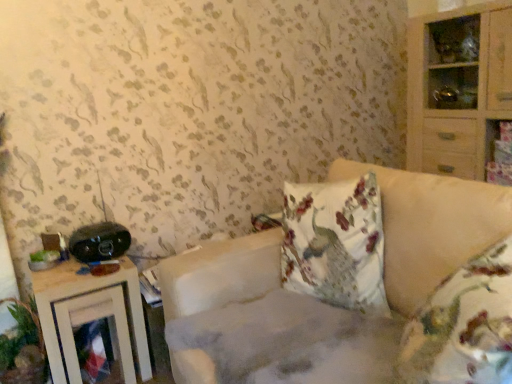
The image size is (512, 384). Find the location of `wooden nightstand at left`. wooden nightstand at left is located at coordinates (91, 316).

Measure the distance between point (116, 247) and camera.

5.72 feet.

Image resolution: width=512 pixels, height=384 pixels. What do you see at coordinates (99, 242) in the screenshot?
I see `black plastic stereo at left` at bounding box center [99, 242].

The width and height of the screenshot is (512, 384). Describe the element at coordinates (22, 346) in the screenshot. I see `green leafy plant at lower left` at that location.

Measure the distance between point [447,273] and camera.

Point [447,273] and camera are 3.73 feet apart from each other.

Locate an element on the screen. This screenshot has width=512, height=384. light wood cabinet at right is located at coordinates (458, 87).

Is black plastic stereo at left at the back of light wood cabinet at right?

That's not correct — light wood cabinet at right is not looking away from black plastic stereo at left.

Looking at this image, from a real-world perspective, is light wood cabinet at right physically located above or below black plastic stereo at left?

From a real-world perspective, light wood cabinet at right is physically above black plastic stereo at left.

Is light wood cabinet at right wider than black plastic stereo at left?

Yes.

Can we say light wood cabinet at right lies outside black plastic stereo at left?

Yes.

Looking at this image, which object is further away from the camera taking this photo, fluffy beige couch at center or wooden nightstand at left?

wooden nightstand at left is more distant.

From the image's perspective, would you say fluffy beige couch at center is shown under wooden nightstand at left?

Incorrect, from the image's perspective, fluffy beige couch at center is higher than wooden nightstand at left.

Considering the relative positions of fluffy beige couch at center and wooden nightstand at left in the image provided, is fluffy beige couch at center to the left or to the right of wooden nightstand at left?

fluffy beige couch at center is to the right of wooden nightstand at left.

Which of these two, fluffy beige couch at center or wooden nightstand at left, is smaller?

Smaller between the two is wooden nightstand at left.

Is fluffy beige couch at center not within black plastic stereo at left?

That's correct, fluffy beige couch at center is outside of black plastic stereo at left.

Is fluffy beige couch at center smaller than black plastic stereo at left?

Actually, fluffy beige couch at center might be larger than black plastic stereo at left.

Is fluffy beige couch at center positioned with its back to black plastic stereo at left?

No, fluffy beige couch at center is not facing the opposite direction of black plastic stereo at left.

Is fluffy beige couch at center placed right next to black plastic stereo at left?

No, fluffy beige couch at center is not beside black plastic stereo at left.

I want to click on plant in front of the wooden nightstand at left, so click(22, 346).

Is point (30, 329) closer to viewer compared to point (61, 361)?

No, (30, 329) is further to viewer.

Is wooden nightstand at left surrounded by green leafy plant at lower left?

No.

In the scene shown: Does black plastic stereo at left have a lesser height compared to light wood cabinet at right?

Yes.

Considering the relative sizes of black plastic stereo at left and light wood cabinet at right in the image provided, is black plastic stereo at left bigger than light wood cabinet at right?

Actually, black plastic stereo at left might be smaller than light wood cabinet at right.

Would you say black plastic stereo at left is inside or outside light wood cabinet at right?

black plastic stereo at left is located beyond the bounds of light wood cabinet at right.

Considering the sizes of green leafy plant at lower left and fluffy beige couch at center in the image, is green leafy plant at lower left bigger or smaller than fluffy beige couch at center?

In the image, green leafy plant at lower left appears to be smaller than fluffy beige couch at center.

From the image's perspective, between green leafy plant at lower left and fluffy beige couch at center, which one is located above?

fluffy beige couch at center is shown above in the image.

From a real-world perspective, is green leafy plant at lower left under fluffy beige couch at center?

Yes.

Would you consider green leafy plant at lower left to be distant from fluffy beige couch at center?

Yes.

Which of these two, fluffy beige couch at center or light wood cabinet at right, is bigger?

With larger size is fluffy beige couch at center.

Is fluffy beige couch at center far from light wood cabinet at right?

fluffy beige couch at center is actually quite close to light wood cabinet at right.

From the picture: From a real-world perspective, between fluffy beige couch at center and light wood cabinet at right, who is vertically lower?

fluffy beige couch at center, from a real-world perspective.

Is fluffy beige couch at center looking in the opposite direction of light wood cabinet at right?

Correct, fluffy beige couch at center is looking away from light wood cabinet at right.

I want to click on cabinetry located behind the black plastic stereo at left, so click(x=458, y=87).

I want to click on studio couch that is in front of the wooden nightstand at left, so click(431, 226).

When comparing their distances from wooden nightstand at left, does black plastic stereo at left or fluffy beige couch at center seem closer?

black plastic stereo at left is closer to wooden nightstand at left.

Which object lies nearer to the anchor point black plastic stereo at left, fluffy beige couch at center or light wood cabinet at right?

fluffy beige couch at center lies closer to black plastic stereo at left than the other object.

Based on their spatial positions, is fluffy beige couch at center or wooden nightstand at left closer to black plastic stereo at left?

The object closer to black plastic stereo at left is wooden nightstand at left.

Considering their positions, is wooden nightstand at left positioned further to light wood cabinet at right than green leafy plant at lower left?

Among the two, green leafy plant at lower left is located further to light wood cabinet at right.

Based on their spatial positions, is wooden nightstand at left or black plastic stereo at left closer to fluffy beige couch at center?

black plastic stereo at left is closer to fluffy beige couch at center.

Based on the photo, considering their positions, is light wood cabinet at right positioned closer to wooden nightstand at left than green leafy plant at lower left?

green leafy plant at lower left is positioned closer to the anchor wooden nightstand at left.

Estimate the real-world distances between objects in this image. Which object is further from light wood cabinet at right, black plastic stereo at left or fluffy beige couch at center?

The object further to light wood cabinet at right is black plastic stereo at left.

Consider the image. From the image, which object appears to be nearer to black plastic stereo at left, green leafy plant at lower left or fluffy beige couch at center?

green leafy plant at lower left is closer to black plastic stereo at left.

I want to click on nightstand between black plastic stereo at left and green leafy plant at lower left in the up-down direction, so click(x=91, y=316).

Find the location of a particular element. The image size is (512, 384). nightstand between fluffy beige couch at center and black plastic stereo at left along the z-axis is located at coordinates (91, 316).

This screenshot has height=384, width=512. I want to click on stereo situated between green leafy plant at lower left and light wood cabinet at right from left to right, so click(x=99, y=242).

This screenshot has height=384, width=512. Find the location of `studio couch located between wooden nightstand at left and light wood cabinet at right in the left-right direction`. studio couch located between wooden nightstand at left and light wood cabinet at right in the left-right direction is located at coordinates (431, 226).